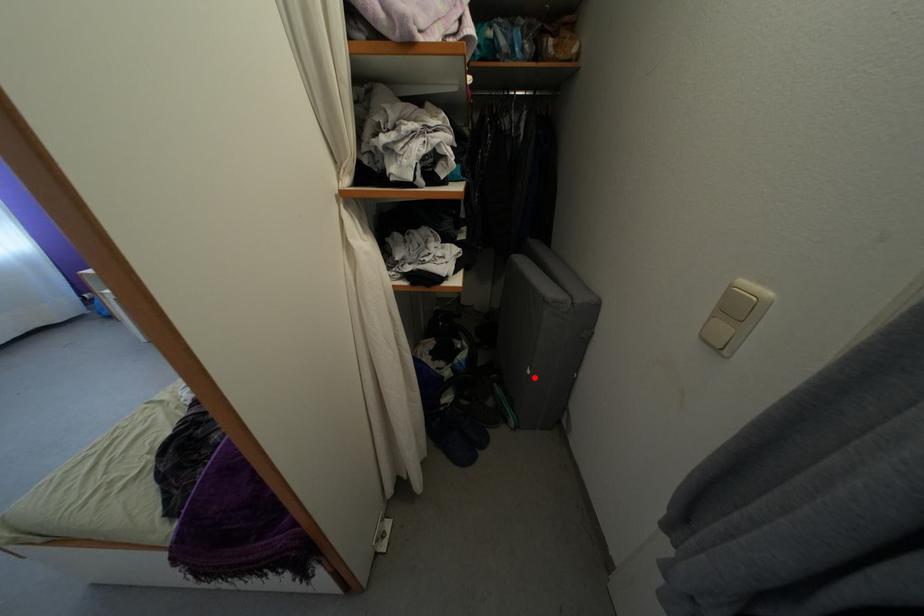
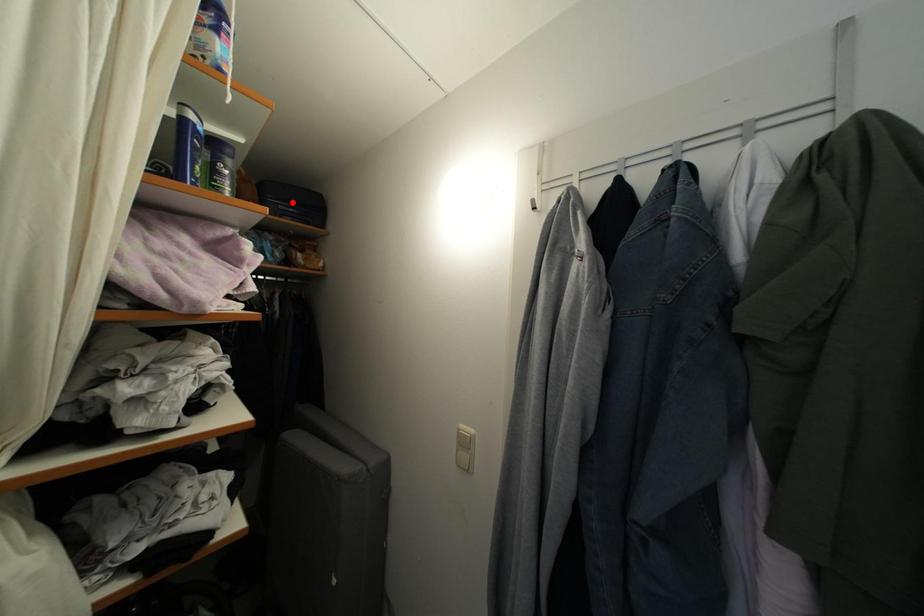
I am providing you with two images of the same scene from different viewpoints. A red point is marked on the first image and another point is marked on the second image. Are the points marked in image1 and image2 representing the same 3D position?

No